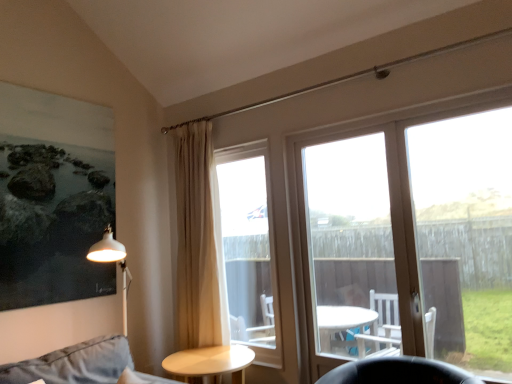
Question: From the image's perspective, does clear glass door at center right appear higher than beige fabric curtain at center?

Choices:
 (A) yes
 (B) no

Answer: (A)

Question: From a real-world perspective, is clear glass door at center right physically below beige fabric curtain at center?

Choices:
 (A) no
 (B) yes

Answer: (B)

Question: Can you confirm if clear glass door at center right is shorter than beige fabric curtain at center?

Choices:
 (A) yes
 (B) no

Answer: (A)

Question: Would you say clear glass door at center right contains beige fabric curtain at center?

Choices:
 (A) no
 (B) yes

Answer: (A)

Question: Does clear glass door at center right have a lesser width compared to beige fabric curtain at center?

Choices:
 (A) yes
 (B) no

Answer: (A)

Question: Does clear glass door at center right have a greater width compared to beige fabric curtain at center?

Choices:
 (A) no
 (B) yes

Answer: (A)

Question: Is beige fabric curtain at center shorter than clear glass door at center?

Choices:
 (A) no
 (B) yes

Answer: (A)

Question: From a real-world perspective, is beige fabric curtain at center physically below clear glass door at center?

Choices:
 (A) no
 (B) yes

Answer: (A)

Question: Is beige fabric curtain at center not within clear glass door at center?

Choices:
 (A) yes
 (B) no

Answer: (A)

Question: Considering the relative sizes of beige fabric curtain at center and clear glass door at center in the image provided, is beige fabric curtain at center bigger than clear glass door at center?

Choices:
 (A) no
 (B) yes

Answer: (B)

Question: Considering the relative sizes of beige fabric curtain at center and clear glass door at center in the image provided, is beige fabric curtain at center smaller than clear glass door at center?

Choices:
 (A) no
 (B) yes

Answer: (A)

Question: Does beige fabric curtain at center appear on the right side of clear glass door at center?

Choices:
 (A) no
 (B) yes

Answer: (A)

Question: Does beige fabric curtain at center have a smaller size compared to clear glass door at center right?

Choices:
 (A) yes
 (B) no

Answer: (B)